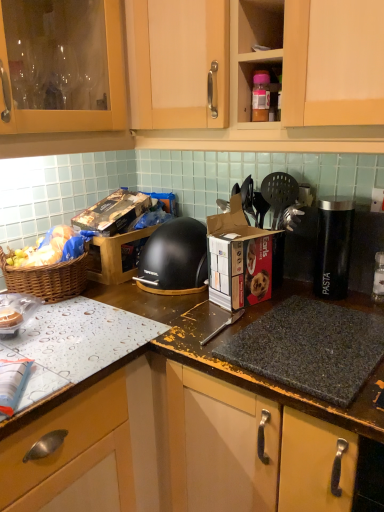
Question: Can you confirm if black plastic canister at right is thinner than black matte food processor at center?

Choices:
 (A) no
 (B) yes

Answer: (B)

Question: Can you confirm if black plastic canister at right is positioned to the right of black matte food processor at center?

Choices:
 (A) yes
 (B) no

Answer: (A)

Question: Is black plastic canister at right aimed at black matte food processor at center?

Choices:
 (A) no
 (B) yes

Answer: (A)

Question: Is black plastic canister at right to the left of black matte food processor at center from the viewer's perspective?

Choices:
 (A) yes
 (B) no

Answer: (B)

Question: Is black plastic canister at right in front of black matte food processor at center?

Choices:
 (A) yes
 (B) no

Answer: (A)

Question: Is black plastic canister at right wider than black matte food processor at center?

Choices:
 (A) no
 (B) yes

Answer: (A)

Question: Can you confirm if granite at center is positioned to the left of brown woven basket at left?

Choices:
 (A) yes
 (B) no

Answer: (B)

Question: Is granite at center thinner than brown woven basket at left?

Choices:
 (A) yes
 (B) no

Answer: (B)

Question: Is the depth of granite at center greater than that of brown woven basket at left?

Choices:
 (A) yes
 (B) no

Answer: (B)

Question: Considering the relative sizes of granite at center and brown woven basket at left in the image provided, is granite at center taller than brown woven basket at left?

Choices:
 (A) no
 (B) yes

Answer: (B)

Question: Does granite at center have a smaller size compared to brown woven basket at left?

Choices:
 (A) no
 (B) yes

Answer: (A)

Question: Does granite at center have a lesser height compared to brown woven basket at left?

Choices:
 (A) yes
 (B) no

Answer: (B)

Question: Is cardboard box at center, acting as the second cardboard box starting from the back, thinner than matte wood cabinet at upper center?

Choices:
 (A) yes
 (B) no

Answer: (A)